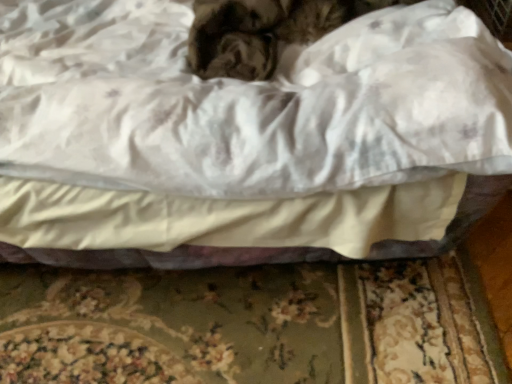
What do you see at coordinates (246, 139) in the screenshot? This screenshot has height=384, width=512. I see `white satin bed at center` at bounding box center [246, 139].

Based on the photo, what is the approximate width of white satin bed at center?

The width of white satin bed at center is 1.38 meters.

At what (x,y) coordinates should I click in order to perform the action: click on white satin bed at center. Please return your answer as a coordinate pair (x, y). This screenshot has width=512, height=384. Looking at the image, I should click on (246, 139).

The height and width of the screenshot is (384, 512). I want to click on white satin bed at center, so click(x=246, y=139).